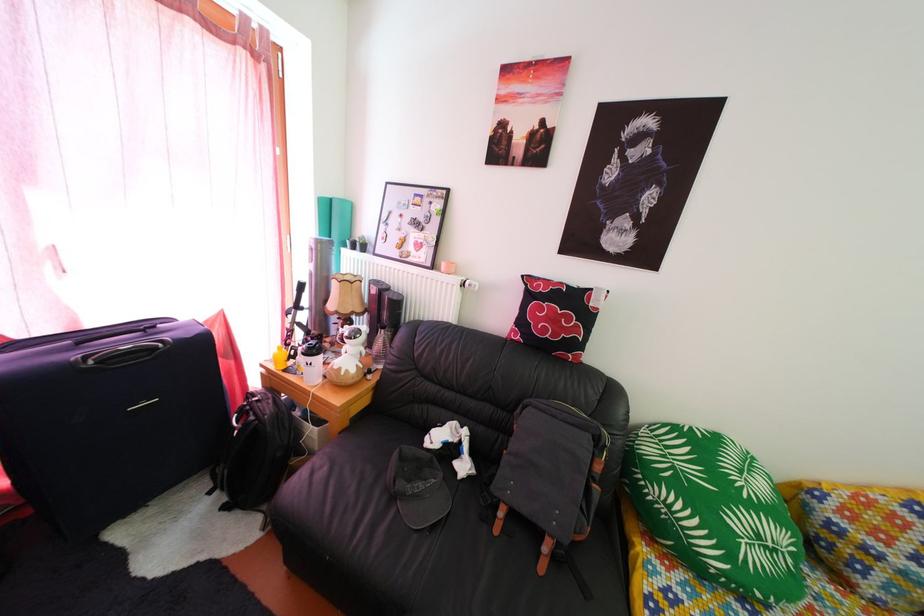
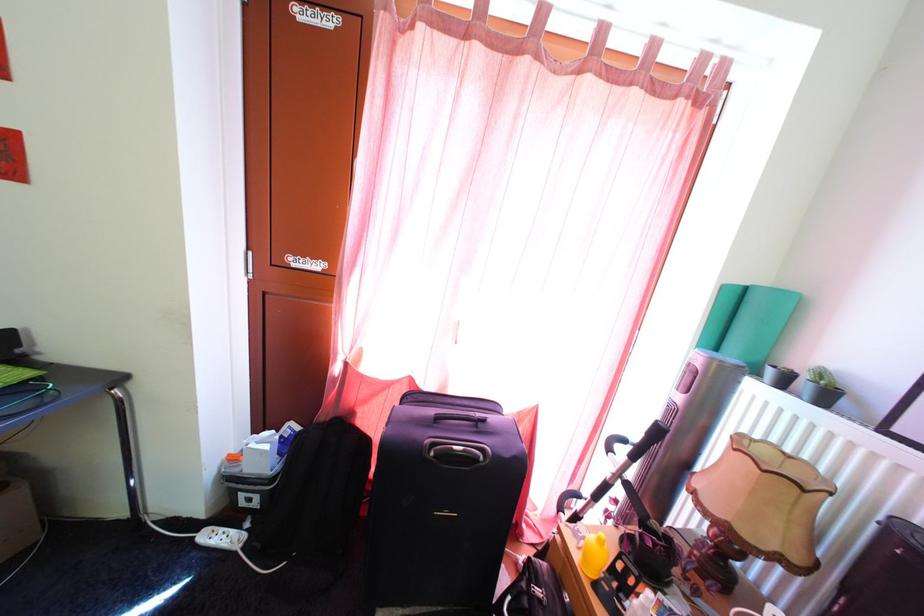
Locate, in the second image, the point that corresponds to the point at 339,208 in the first image.

(756, 297)